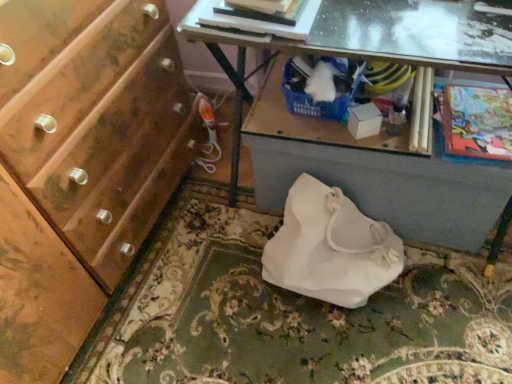
Question: From a real-world perspective, is white fabric bag at center on top of hardcover book at upper center?

Choices:
 (A) no
 (B) yes

Answer: (A)

Question: Is white fabric bag at center wider than hardcover book at upper center?

Choices:
 (A) yes
 (B) no

Answer: (B)

Question: Is white fabric bag at center bigger than hardcover book at upper center?

Choices:
 (A) yes
 (B) no

Answer: (A)

Question: Is white fabric bag at center smaller than hardcover book at upper center?

Choices:
 (A) yes
 (B) no

Answer: (B)

Question: Is white fabric bag at center positioned in front of hardcover book at upper center?

Choices:
 (A) yes
 (B) no

Answer: (B)

Question: From the image's perspective, is white fabric bag at lower center located above or below matte black magazine at upper center, positioned as the second magazine in back-to-front order?

Choices:
 (A) below
 (B) above

Answer: (A)

Question: Looking at the image, does white fabric bag at lower center seem bigger or smaller compared to matte black magazine at upper center, positioned as the second magazine in bottom-to-top order?

Choices:
 (A) small
 (B) big

Answer: (B)

Question: Considering the positions of white fabric bag at lower center and matte black magazine at upper center, the 1th magazine when ordered from top to bottom, in the image, is white fabric bag at lower center taller or shorter than matte black magazine at upper center, the 1th magazine when ordered from top to bottom,?

Choices:
 (A) short
 (B) tall

Answer: (A)

Question: Considering the positions of point (147, 261) and point (246, 13), is point (147, 261) closer or farther from the camera than point (246, 13)?

Choices:
 (A) farther
 (B) closer

Answer: (A)

Question: Relative to white fabric bag at lower center, is transparent glass table at upper center in front or behind?

Choices:
 (A) behind
 (B) front

Answer: (B)

Question: Is transparent glass table at upper center inside the boundaries of white fabric bag at lower center, or outside?

Choices:
 (A) inside
 (B) outside

Answer: (B)

Question: From the image's perspective, is transparent glass table at upper center located above or below white fabric bag at lower center?

Choices:
 (A) above
 (B) below

Answer: (A)

Question: In terms of size, does transparent glass table at upper center appear bigger or smaller than white fabric bag at lower center?

Choices:
 (A) small
 (B) big

Answer: (A)

Question: Considering the positions of white fabric bag at center and matte black magazine at upper center, marked as the 2th magazine in a right-to-left arrangement, in the image, is white fabric bag at center wider or thinner than matte black magazine at upper center, marked as the 2th magazine in a right-to-left arrangement,?

Choices:
 (A) thin
 (B) wide

Answer: (B)

Question: Is white fabric bag at center spatially inside matte black magazine at upper center, which is the 1th magazine in front-to-back order, or outside of it?

Choices:
 (A) inside
 (B) outside

Answer: (B)